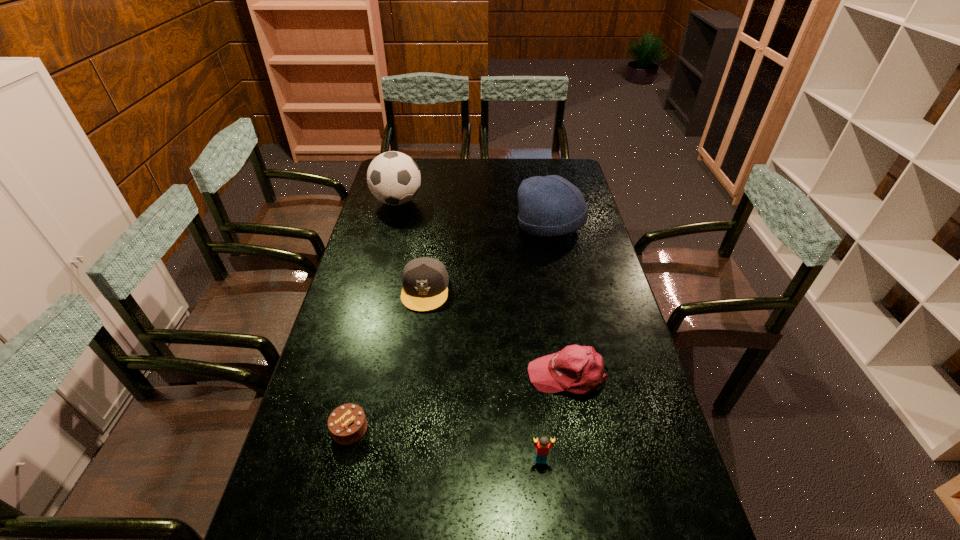
This screenshot has height=540, width=960. I want to click on vacant space located at the front of the fourth farthest object with the brim, so tap(402, 375).

I want to click on free space located at the front of the fourth farthest object with the brim, so click(x=434, y=375).

Find the location of a particular element. This screenshot has height=540, width=960. vacant position located on the front-facing side of the cap is located at coordinates (415, 366).

The height and width of the screenshot is (540, 960). Identify the location of free point located on the face of the Lego. (547, 524).

Image resolution: width=960 pixels, height=540 pixels. I want to click on vacant position located 0.270m on the right of the chocolate cake, so click(475, 429).

This screenshot has width=960, height=540. I want to click on soccer ball that is at the left edge, so click(x=393, y=178).

Find the location of a particular element. The height and width of the screenshot is (540, 960). chocolate cake located at the left edge is located at coordinates (347, 424).

This screenshot has width=960, height=540. What are the coordinates of `skullcap that is at the right edge` in the screenshot? It's located at (549, 206).

This screenshot has height=540, width=960. Identify the location of baseball cap that is at the right edge. [x=577, y=369].

Image resolution: width=960 pixels, height=540 pixels. In the image, there is a desktop. In order to click on vacant space at the far edge in this screenshot , I will do (505, 182).